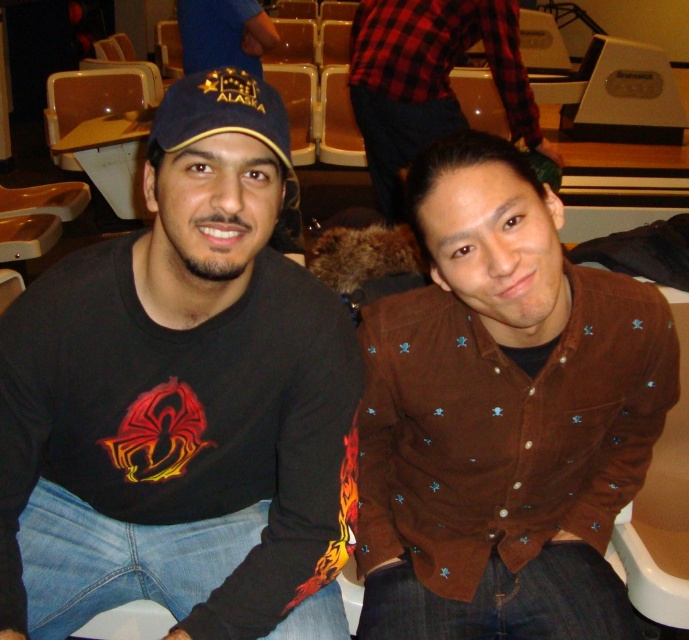
You are a photographer setting up for a group photo. You need to ensure that both the brown corduroy shirt at center and the blue fabric cap at upper center are clearly visible in the frame. Given their positions, which object should you focus on first to ensure both are in focus?

The brown corduroy shirt at center is closer to the viewer than the blue fabric cap at upper center. To ensure both are in focus, you should focus on the brown corduroy shirt at center first, as it is the closer object, and adjust the depth of field to include the blue fabric cap at upper center.